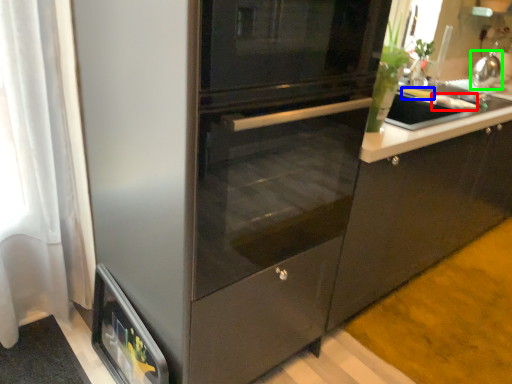
Question: Based on their relative distances, which object is nearer to food (highlighted by a red box)? Choose from food (highlighted by a blue box) and kitchen appliance (highlighted by a green box).

Choices:
 (A) food
 (B) kitchen appliance

Answer: (A)